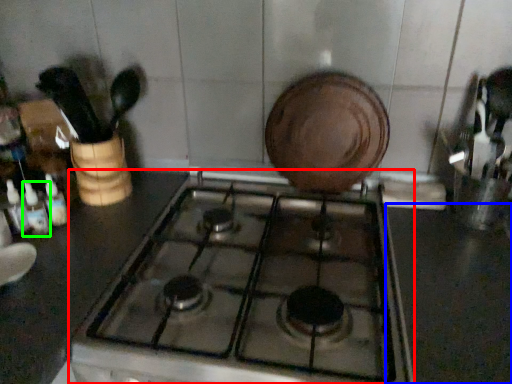
Question: Which is farther away from gas stove (highlighted by a red box)? counter top (highlighted by a blue box) or bottle (highlighted by a green box)?

Choices:
 (A) counter top
 (B) bottle

Answer: (B)